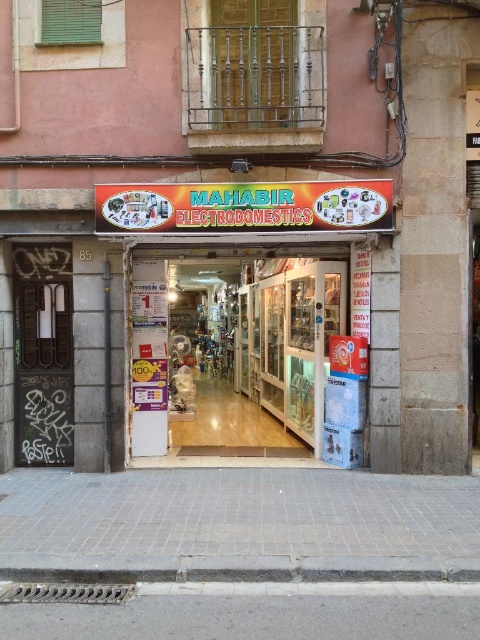
You are a delivery person trying to park your 1.2 meter wide delivery van near the entrance of Mahabir Electrodomesticos. The van needs to be parked on the gray concrete pavement at lower center or the gray concrete curb at lower center. Based on their sizes, which location can accommodate the van?

The gray concrete pavement at lower center has a larger size compared to the gray concrete curb at lower center, so the van can be parked on the gray concrete pavement at lower center since it is wider than the curb.

You are a delivery person arriving at Mahabir Electrodomesticos. You need to unload a package from your truck parked on the gray concrete pavement at lower center. To enter the shop, you must go through the grungy metal door at left. Is the door accessible from the pavement?

The gray concrete pavement at lower center is below the grungy metal door at left, so yes, the door is accessible from the pavement.